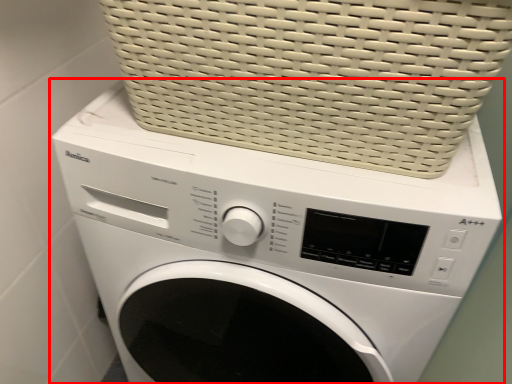
Question: In this image, where is washing machine (annotated by the red box) located relative to basket?

Choices:
 (A) right
 (B) left

Answer: (B)